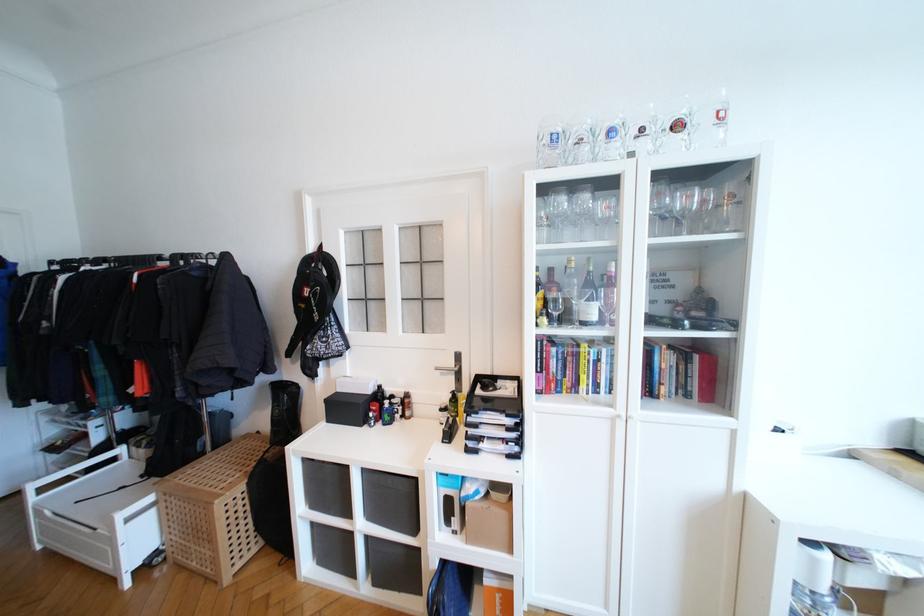
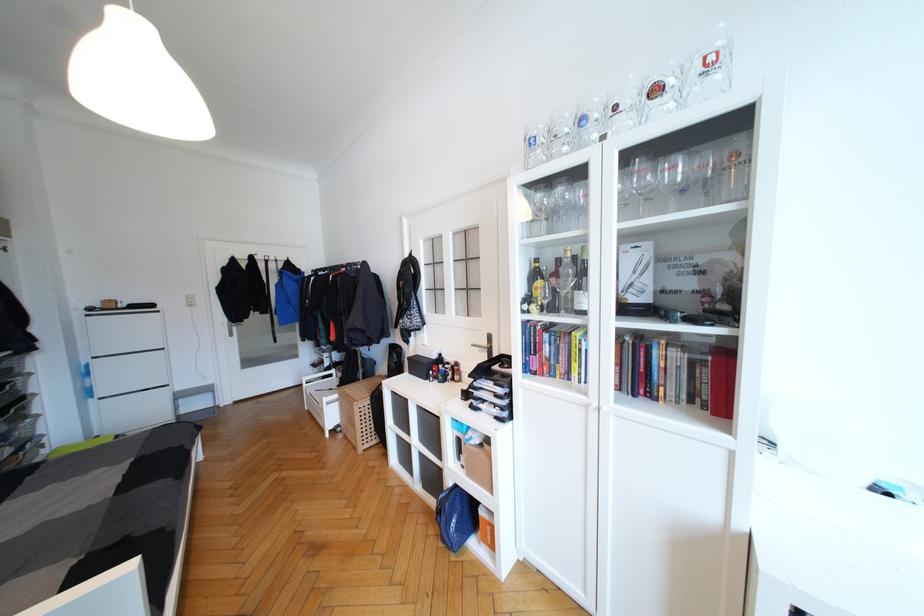
Find the pixel in the second image that matches (661,177) in the first image.

(631, 156)